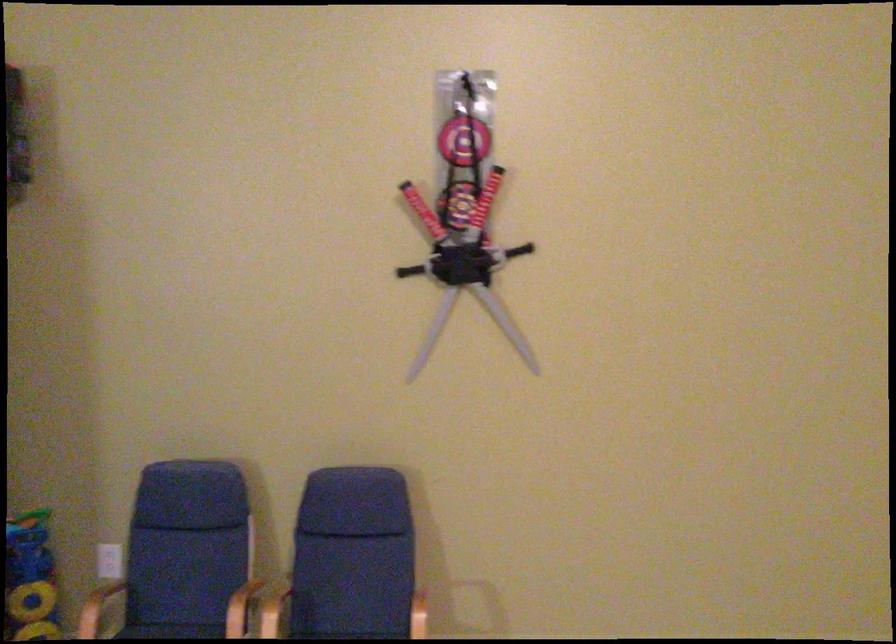
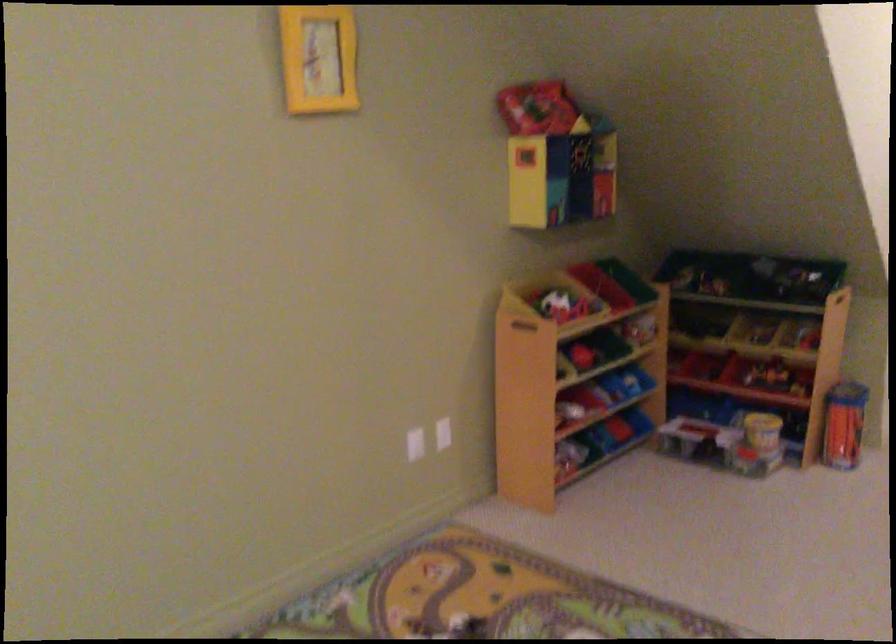
Question: How did the camera likely rotate?

Choices:
 (A) Left
 (B) Right
 (C) Up
 (D) Down

Answer: (B)